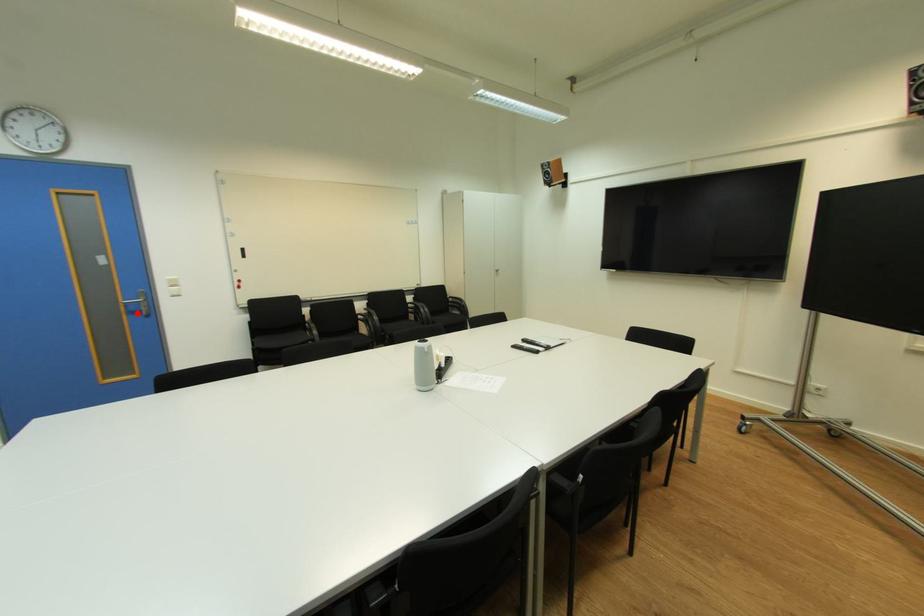
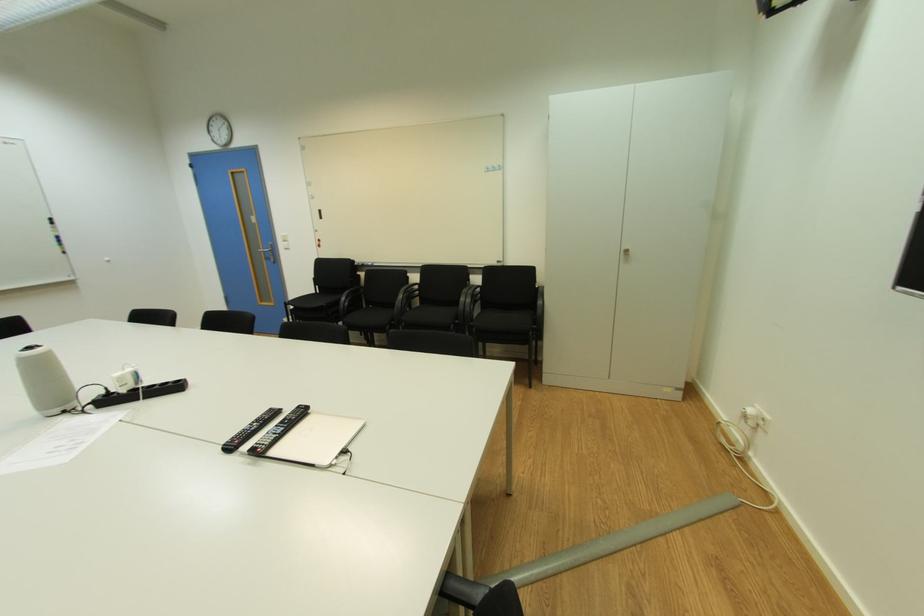
The point at the highlighted location is marked in the first image. Where is the corresponding point in the second image?

(274, 260)